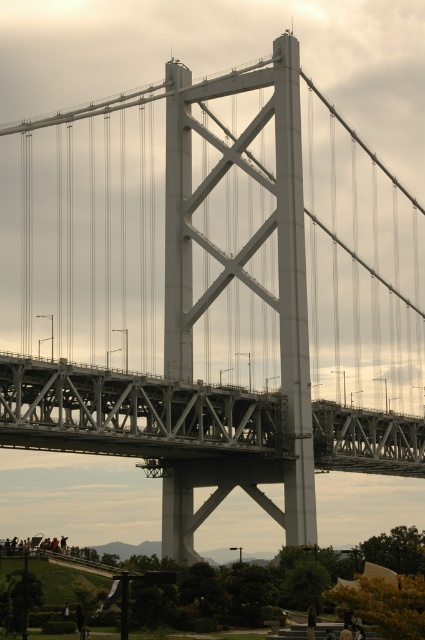
You are standing on a platform 400 feet away from the gray metallic bridge at center. You want to walk towards it. Can you reach the bridge before the distance becomes less than 390.58 feet?

The gray metallic bridge at center is currently 390.58 feet away from you. Since you are starting at 400 feet away, walking towards it will decrease the distance. You will reach the bridge when the distance is 0, so yes, you can reach the bridge before the distance becomes less than 390.58 feet because you are already farther away than that distance.

You are standing on the green grass at lower left and want to cross to the gray metallic bridge at center. Is the bridge directly above you, or do you need to walk towards it?

The gray metallic bridge at center is above the green grass at lower left, so you are already directly underneath it and do not need to walk towards it.